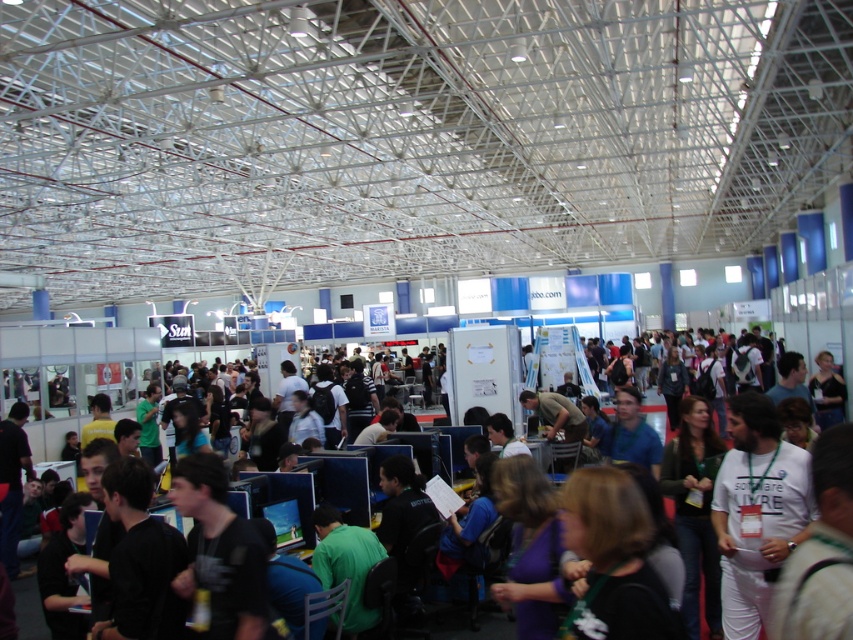
Based on the photo, does white matte t-shirt at center-right appear under dark blue shirt at center?

Correct, white matte t-shirt at center-right is located below dark blue shirt at center.

Which of these two, white matte t-shirt at center-right or dark blue shirt at center, stands shorter?

With less height is white matte t-shirt at center-right.

Who is more distant from viewer, (767, 467) or (80, 348)?

The point (80, 348) is behind.

Identify the location of white matte t-shirt at center-right. Image resolution: width=853 pixels, height=640 pixels. (x=756, y=509).